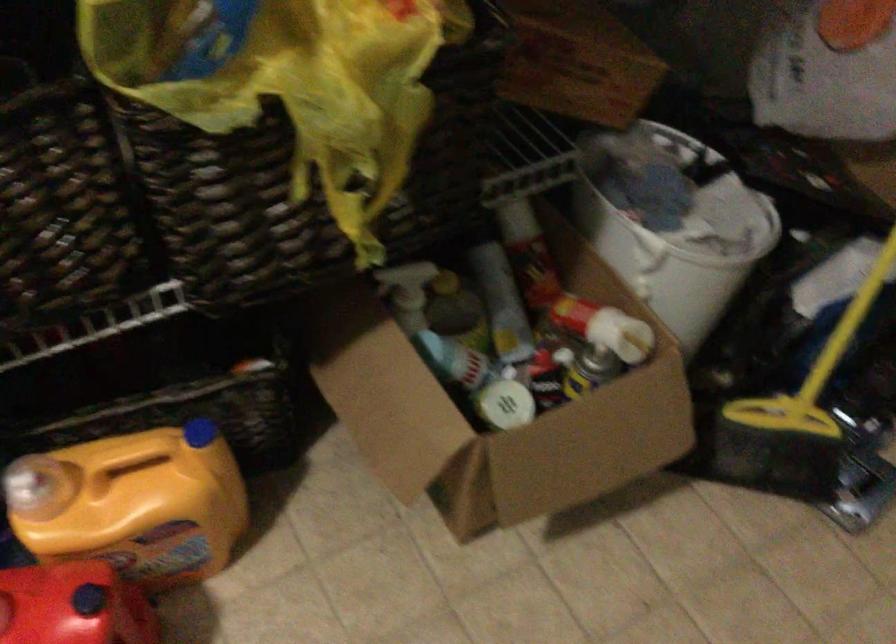
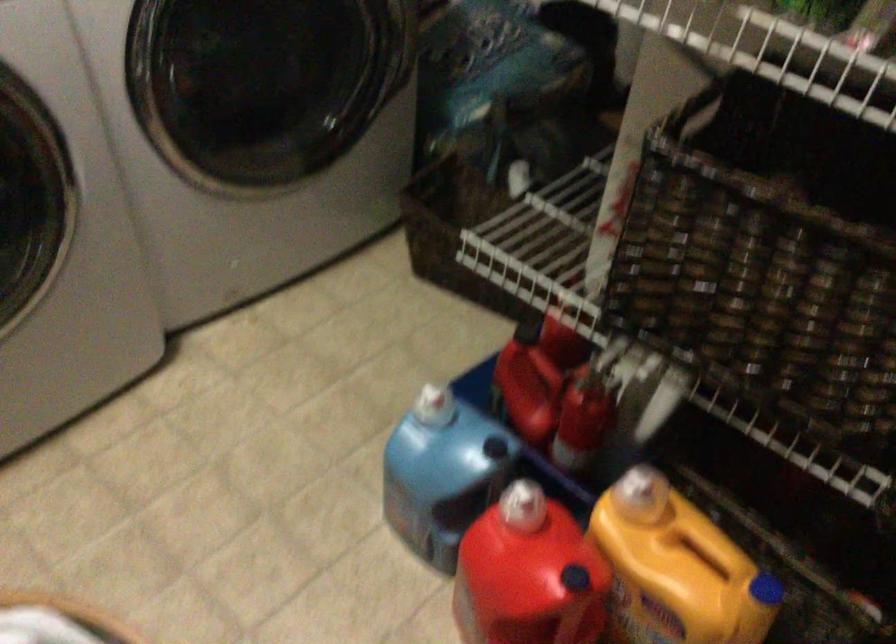
Question: The images are taken continuously from a first-person perspective. In which direction is your viewpoint rotating?

Choices:
 (A) Left
 (B) Right
 (C) Up
 (D) Down

Answer: (A)